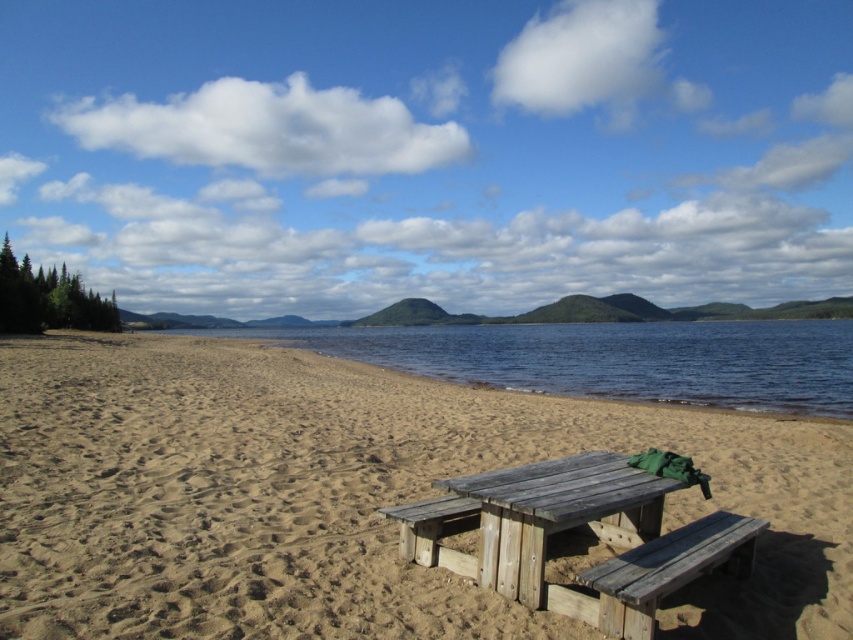
Question: Which object appears farthest from the camera in this image?

Choices:
 (A) wooden park bench at lower right
 (B) brown sandy beach at center

Answer: (B)

Question: Estimate the real-world distances between objects in this image. Which object is closer to the wooden picnic table at lower center?

Choices:
 (A) wooden park bench at lower right
 (B) weathered wood picnic table at center
 (C) brown sandy beach at center

Answer: (B)

Question: Does weathered wood picnic table at center have a smaller size compared to wooden picnic table at lower center?

Choices:
 (A) no
 (B) yes

Answer: (A)

Question: Is brown sandy beach at center smaller than wooden park bench at lower right?

Choices:
 (A) no
 (B) yes

Answer: (A)

Question: Which point appears farthest from the camera in this image?

Choices:
 (A) (440, 508)
 (B) (616, 621)
 (C) (514, 554)
 (D) (181, 408)

Answer: (D)

Question: Is weathered wood picnic table at center closer to the viewer compared to wooden picnic table at lower center?

Choices:
 (A) no
 (B) yes

Answer: (B)